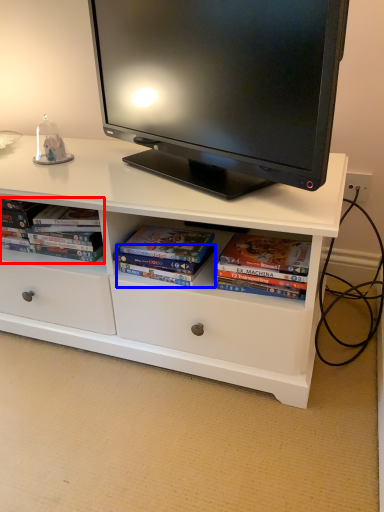
Question: Among these objects, which one is farthest to the camera, book (highlighted by a red box) or paperback book (highlighted by a blue box)?

Choices:
 (A) book
 (B) paperback book

Answer: (A)